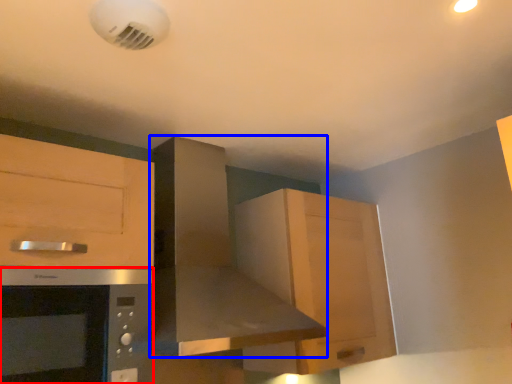
Question: Which object appears farthest to the camera in this image, microwave oven (highlighted by a red box) or home appliance (highlighted by a blue box)?

Choices:
 (A) microwave oven
 (B) home appliance

Answer: (B)